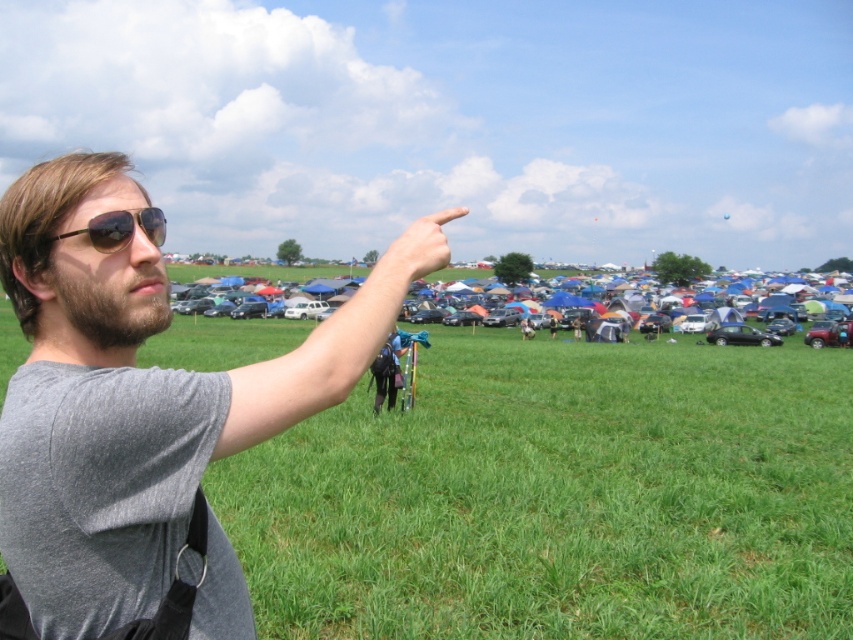
Is gray matte shirt at upper left shorter than shiny metallic cars at center?

Indeed, gray matte shirt at upper left has a lesser height compared to shiny metallic cars at center.

Based on the photo, measure the distance between point (88, 525) and camera.

A distance of 1.36 meters exists between point (88, 525) and camera.

Where is `gray matte shirt at upper left`? This screenshot has height=640, width=853. gray matte shirt at upper left is located at coordinates (125, 403).

Between gray matte shirt at upper left and matte black sunglasses at upper left, which one appears on the left side from the viewer's perspective?

matte black sunglasses at upper left

Which is behind, point (119, 317) or point (90, 225)?

The point (119, 317) is more distant.

Describe the element at coordinates (125, 403) in the screenshot. I see `gray matte shirt at upper left` at that location.

Find the location of a particular element. gray matte shirt at upper left is located at coordinates (125, 403).

Is point (743, 291) farther from camera compared to point (378, 259)?

Yes.

Between point (827, 305) and point (403, 266), which one is positioned behind?

Point (827, 305)

At what (x,y) coordinates should I click in order to perform the action: click on shiny metallic cars at center. Please return your answer as a coordinate pair (x, y). The height and width of the screenshot is (640, 853). Looking at the image, I should click on click(x=831, y=324).